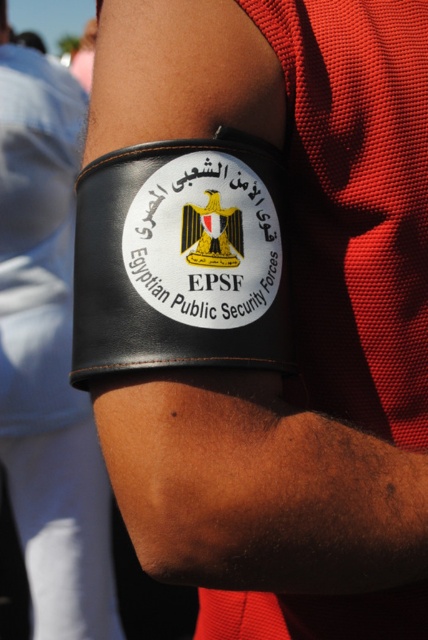
You are a tailor measuring the distance between the black leather armband at center and the black leather patch at upper center for a custom uniform. The minimum required distance between these two items is 1.5 meters. Can you confirm if the current placement meets the requirement?

The black leather armband at center is 1.79 meters from the black leather patch at upper center, which exceeds the minimum required distance of 1.5 meters. Therefore, the current placement meets the requirement.

You are an inspector examining the armband and patch on the person. Which object is closer to you, the black leather armband at center or the black leather patch at upper center?

The black leather armband at center is closer to you than the black leather patch at upper center because it is further to the viewer.

What is the exact 2D coordinate of the black leather patch at center?

The black leather patch at center is located at the coordinate point of (181, 259).